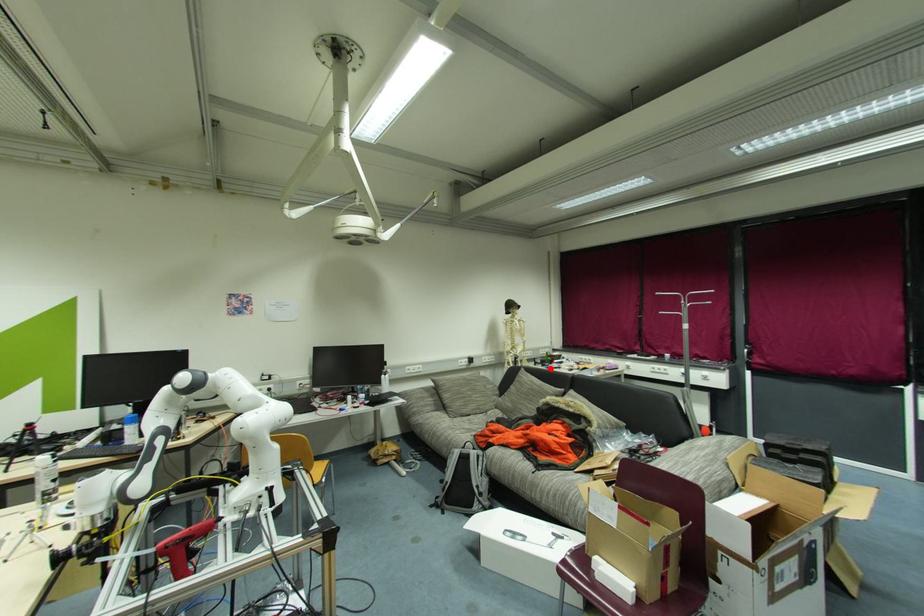
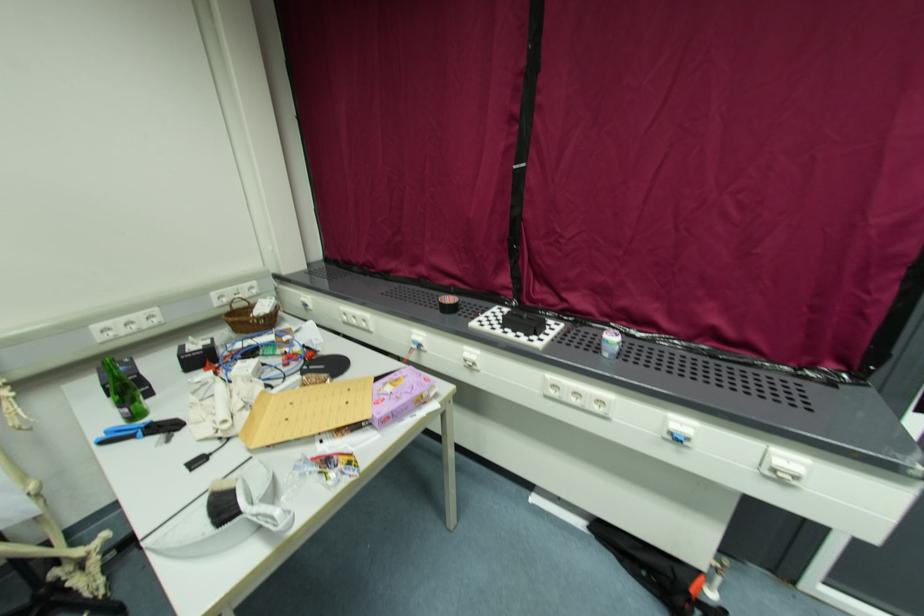
Question: I am providing you with two images of the same scene from different viewpoints. A red point is shown in image1. For the corresponding object point in image2, is it positioned nearer or farther from the camera?

Choices:
 (A) Nearer
 (B) Farther

Answer: (A)